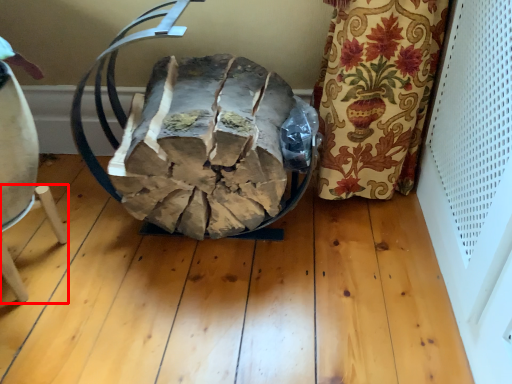
Question: Considering the relative positions of furniture (annotated by the red box) and bean bag chair in the image provided, where is furniture (annotated by the red box) located with respect to the staircase?

Choices:
 (A) left
 (B) right

Answer: (A)